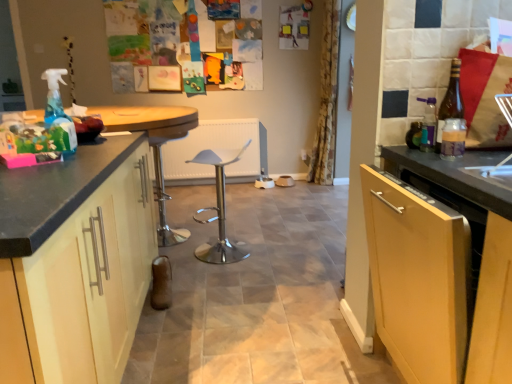
Identify the location of polished silver bar stool at center, positioned as the 1th bar stool in right-to-left order. (219, 209).

What do you see at coordinates (219, 209) in the screenshot? I see `polished silver bar stool at center, acting as the 2th bar stool starting from the left` at bounding box center [219, 209].

Describe the element at coordinates (75, 263) in the screenshot. I see `matte black cabinet at left` at that location.

Identify the location of black granite countertop at left. (77, 175).

This screenshot has height=384, width=512. Describe the element at coordinates (77, 175) in the screenshot. I see `black granite countertop at left` at that location.

What are the coordinates of `translucent plastic bottle at right, marked as the 1th bottle in a front-to-back arrangement` in the screenshot? It's located at (453, 139).

In order to click on polished chrome bar stool at center, the 1th bar stool from the left in this screenshot , I will do `click(164, 187)`.

The height and width of the screenshot is (384, 512). What are the coordinates of `polished silver bar stool at center, acting as the 2th bar stool starting from the left` in the screenshot? It's located at (219, 209).

Between matte black cabinet at left and polished chrome bar stool at center, the 1th bar stool from the left, which one has smaller size?

With smaller size is polished chrome bar stool at center, the 1th bar stool from the left.

Could you tell me if matte black cabinet at left is turned towards polished chrome bar stool at center, the 1th bar stool from the left?

No, matte black cabinet at left is not turned towards polished chrome bar stool at center, the 1th bar stool from the left.

Is matte black cabinet at left in front of or behind polished chrome bar stool at center, placed as the 2th bar stool when sorted from right to left, in the image?

matte black cabinet at left is in front of polished chrome bar stool at center, placed as the 2th bar stool when sorted from right to left.

Based on the photo, based on their sizes in the image, would you say black granite countertop at left is bigger or smaller than matte black cabinet at left?

Considering their sizes, black granite countertop at left takes up more space than matte black cabinet at left.

From a real-world perspective, which object stands above the other?

black granite countertop at left is physically above.

Does black granite countertop at left contain matte black cabinet at left?

No, black granite countertop at left does not contain matte black cabinet at left.

Considering the relative positions of black granite countertop at left and matte black cabinet at left in the image provided, is black granite countertop at left to the left or to the right of matte black cabinet at left?

From the image, it's evident that black granite countertop at left is to the left of matte black cabinet at left.

Locate an element on the screen. The height and width of the screenshot is (384, 512). countertop below the brown glass bottle at right, the 1th bottle in the back-to-front sequence (from the image's perspective) is located at coordinates (77, 175).

Which object is more forward, black granite countertop at left or brown glass bottle at right, which is counted as the second bottle, starting from the front?

brown glass bottle at right, which is counted as the second bottle, starting from the front, is more forward.

From the image's perspective, between black granite countertop at left and brown glass bottle at right, which is counted as the second bottle, starting from the front, who is located below?

black granite countertop at left.

Is black granite countertop at left far away from brown glass bottle at right, which is counted as the second bottle, starting from the front?

black granite countertop at left is positioned a significant distance from brown glass bottle at right, which is counted as the second bottle, starting from the front.

Is yellow floral fabric curtain at center facing towards matte black cabinet at left?

No, yellow floral fabric curtain at center is not aimed at matte black cabinet at left.

There is a matte black cabinet at left. What are the coordinates of `curtain above it (from a real-world perspective)` in the screenshot? It's located at (327, 99).

From a real-world perspective, who is located higher, yellow floral fabric curtain at center or matte black cabinet at left?

yellow floral fabric curtain at center, from a real-world perspective.

Is yellow floral fabric curtain at center positioned beyond the bounds of matte black cabinet at left?

Absolutely, yellow floral fabric curtain at center is external to matte black cabinet at left.

From the image's perspective, which one is positioned higher, translucent plastic bottle at right, which ranks as the 2th bottle in back-to-front order, or black granite countertop at left?

From the image's view, translucent plastic bottle at right, which ranks as the 2th bottle in back-to-front order, is above.

Does translucent plastic bottle at right, marked as the 1th bottle in a front-to-back arrangement, turn towards black granite countertop at left?

No, translucent plastic bottle at right, marked as the 1th bottle in a front-to-back arrangement, is not turned towards black granite countertop at left.

In terms of height, does translucent plastic bottle at right, marked as the 1th bottle in a front-to-back arrangement, look taller or shorter compared to black granite countertop at left?

translucent plastic bottle at right, marked as the 1th bottle in a front-to-back arrangement, is shorter than black granite countertop at left.

Is translucent plastic bottle at right, which ranks as the 2th bottle in back-to-front order, next to black granite countertop at left and touching it?

translucent plastic bottle at right, which ranks as the 2th bottle in back-to-front order, and black granite countertop at left are not in contact.

Consider the image. Visually, is brown glass bottle at right, which is counted as the second bottle, starting from the front, positioned to the left or to the right of black granite countertop at left?

brown glass bottle at right, which is counted as the second bottle, starting from the front, is to the right of black granite countertop at left.

Is black granite countertop at left completely or partially inside brown glass bottle at right, the 1th bottle in the back-to-front sequence?

No, black granite countertop at left is not a part of brown glass bottle at right, the 1th bottle in the back-to-front sequence.

Based on the photo, from the image's perspective, is brown glass bottle at right, which is counted as the second bottle, starting from the front, above or below black granite countertop at left?

From the image's perspective, brown glass bottle at right, which is counted as the second bottle, starting from the front, appears above black granite countertop at left.

Who is smaller, brown glass bottle at right, the 1th bottle in the back-to-front sequence, or black granite countertop at left?

Smaller between the two is brown glass bottle at right, the 1th bottle in the back-to-front sequence.

Is yellow floral fabric curtain at center looking in the opposite direction of polished chrome bar stool at center, placed as the 2th bar stool when sorted from right to left?

No, yellow floral fabric curtain at center is not facing the opposite direction of polished chrome bar stool at center, placed as the 2th bar stool when sorted from right to left.

Can you tell me how much yellow floral fabric curtain at center and polished chrome bar stool at center, placed as the 2th bar stool when sorted from right to left, differ in facing direction?

62.5 degrees separate the facing orientations of yellow floral fabric curtain at center and polished chrome bar stool at center, placed as the 2th bar stool when sorted from right to left.

Looking at this image, how much distance is there between yellow floral fabric curtain at center and polished chrome bar stool at center, the 1th bar stool from the left?

yellow floral fabric curtain at center is 6.64 feet away from polished chrome bar stool at center, the 1th bar stool from the left.

From a real-world perspective, is yellow floral fabric curtain at center on top of polished chrome bar stool at center, the 1th bar stool from the left?

Correct, in the physical world, yellow floral fabric curtain at center is higher than polished chrome bar stool at center, the 1th bar stool from the left.

Identify the location of cabinetry below the polished chrome bar stool at center, placed as the 2th bar stool when sorted from right to left (from the image's perspective). (75, 263).

At what (x,y) coordinates should I click in order to perform the action: click on countertop behind the matte black cabinet at left. Please return your answer as a coordinate pair (x, y). The width and height of the screenshot is (512, 384). Looking at the image, I should click on (77, 175).

Considering their positions, is yellow floral fabric curtain at center positioned further to polished silver bar stool at center, acting as the 2th bar stool starting from the left, than polished chrome bar stool at center, placed as the 2th bar stool when sorted from right to left?

Based on the image, yellow floral fabric curtain at center appears to be further to polished silver bar stool at center, acting as the 2th bar stool starting from the left.

From the image, which object appears to be farther from polished silver bar stool at center, acting as the 2th bar stool starting from the left, polished chrome bar stool at center, placed as the 2th bar stool when sorted from right to left, or yellow floral fabric curtain at center?

The object further to polished silver bar stool at center, acting as the 2th bar stool starting from the left, is yellow floral fabric curtain at center.

Considering their positions, is brown glass bottle at right, which is counted as the second bottle, starting from the front, positioned further to polished chrome bar stool at center, placed as the 2th bar stool when sorted from right to left, than translucent plastic bottle at right, marked as the 1th bottle in a front-to-back arrangement?

translucent plastic bottle at right, marked as the 1th bottle in a front-to-back arrangement.

Based on their spatial positions, is translucent plastic bottle at right, which ranks as the 2th bottle in back-to-front order, or brown glass bottle at right, which is counted as the second bottle, starting from the front, further from polished chrome bar stool at center, the 1th bar stool from the left?

translucent plastic bottle at right, which ranks as the 2th bottle in back-to-front order.

In the scene shown: Based on their spatial positions, is black granite countertop at left or brown glass bottle at right, which is counted as the second bottle, starting from the front, closer to polished chrome bar stool at center, placed as the 2th bar stool when sorted from right to left?

The object closer to polished chrome bar stool at center, placed as the 2th bar stool when sorted from right to left, is black granite countertop at left.

When comparing their distances from polished silver bar stool at center, acting as the 2th bar stool starting from the left, does yellow floral fabric curtain at center or brown glass bottle at right, which is counted as the second bottle, starting from the front, seem further?

brown glass bottle at right, which is counted as the second bottle, starting from the front, is positioned further to the anchor polished silver bar stool at center, acting as the 2th bar stool starting from the left.

Looking at the image, which one is located further to yellow floral fabric curtain at center, polished silver bar stool at center, positioned as the 1th bar stool in right-to-left order, or matte black cabinet at left?

matte black cabinet at left.

Which object lies further to the anchor point yellow floral fabric curtain at center, matte black cabinet at left or polished silver bar stool at center, acting as the 2th bar stool starting from the left?

Among the two, matte black cabinet at left is located further to yellow floral fabric curtain at center.

At what (x,y) coordinates should I click in order to perform the action: click on bar stool between matte black cabinet at left and polished chrome bar stool at center, placed as the 2th bar stool when sorted from right to left, along the z-axis. Please return your answer as a coordinate pair (x, y). Looking at the image, I should click on (219, 209).

Image resolution: width=512 pixels, height=384 pixels. I want to click on countertop between matte black cabinet at left and yellow floral fabric curtain at center from front to back, so click(x=77, y=175).

Where is `bottle between black granite countertop at left and brown glass bottle at right, the 1th bottle in the back-to-front sequence, in the horizontal direction`? bottle between black granite countertop at left and brown glass bottle at right, the 1th bottle in the back-to-front sequence, in the horizontal direction is located at coordinates (453, 139).

The width and height of the screenshot is (512, 384). What are the coordinates of `bar stool between polished chrome bar stool at center, the 1th bar stool from the left, and yellow floral fabric curtain at center, in the horizontal direction` in the screenshot? It's located at (219, 209).